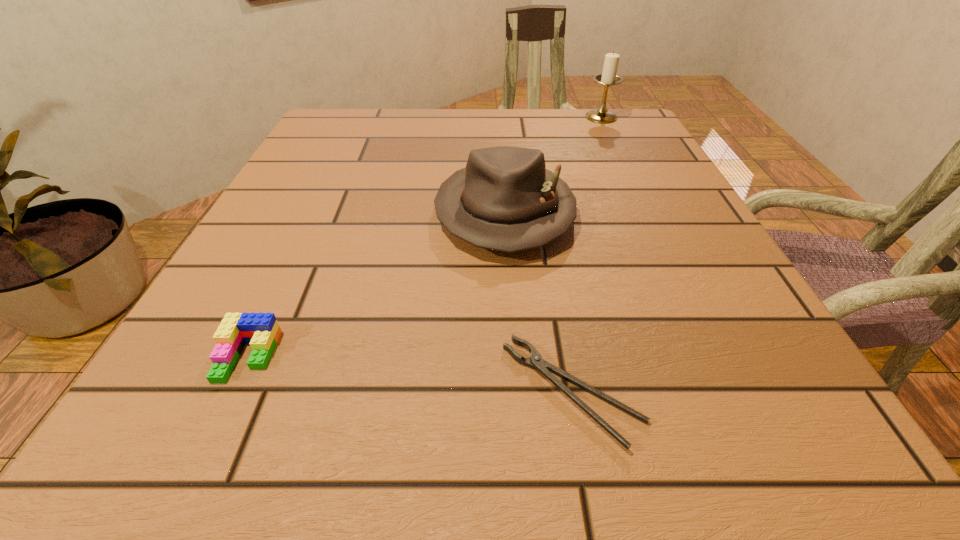
Find the location of `vacant point located between the Lego and the candle holder`. vacant point located between the Lego and the candle holder is located at coordinates (424, 237).

You are a GUI agent. You are given a task and a screenshot of the screen. Output one action in this format:
    pyautogui.click(x=<x>, y=<y>)
    Task: Click on the empty location between the shortest object and the candle holder
    Image resolution: width=960 pixels, height=540 pixels.
    Given the screenshot: What is the action you would take?
    pyautogui.click(x=587, y=254)

You are a GUI agent. You are given a task and a screenshot of the screen. Output one action in this format:
    pyautogui.click(x=<x>, y=<y>)
    Task: Click on the vacant space that is in between the second farthest object and the rightmost object
    The height and width of the screenshot is (540, 960).
    Given the screenshot: What is the action you would take?
    pyautogui.click(x=553, y=165)

Locate an element on the screen. This screenshot has height=540, width=960. object that stands as the second closest to the tallest object is located at coordinates (535, 361).

In order to click on object that is the second closest to the hat in this screenshot , I will do `click(261, 330)`.

I want to click on free location that satisfies the following two spatial constraints: 1. on the back side of the farthest object; 2. on the left side of the Lego, so click(361, 117).

Where is `vacant area that satisfies the following two spatial constraints: 1. on the front side of the Lego; 2. on the right side of the tongs`? vacant area that satisfies the following two spatial constraints: 1. on the front side of the Lego; 2. on the right side of the tongs is located at coordinates (231, 392).

Where is `free space that satisfies the following two spatial constraints: 1. on the decorative side of the shortest object; 2. on the left side of the second tallest object`? free space that satisfies the following two spatial constraints: 1. on the decorative side of the shortest object; 2. on the left side of the second tallest object is located at coordinates (517, 392).